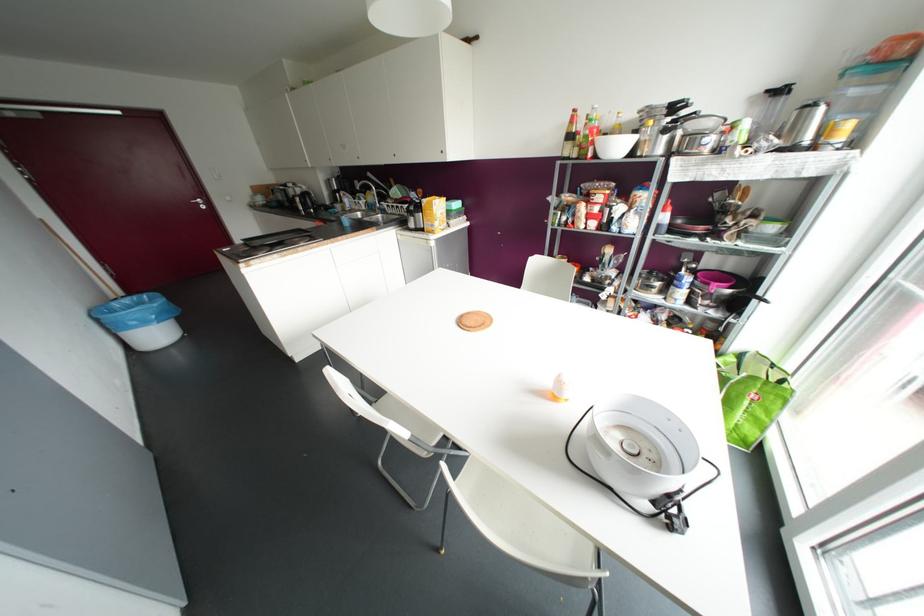
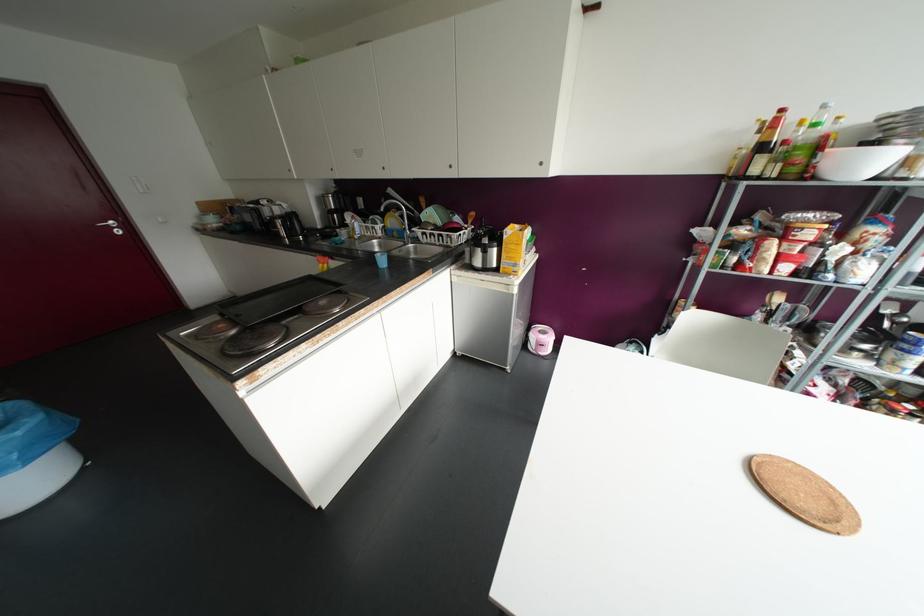
Locate, in the second image, the point that corresponds to point 383,204 in the first image.

(417, 231)